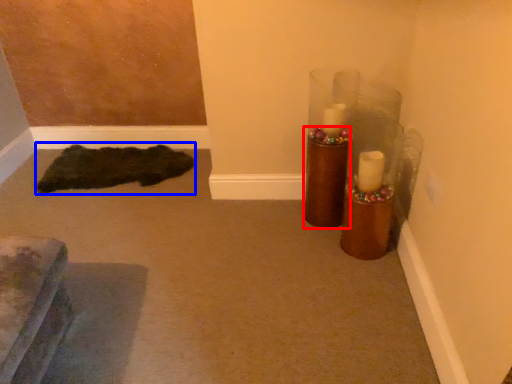
Question: Which object is further to the camera taking this photo, candle holder (highlighted by a red box) or doormat (highlighted by a blue box)?

Choices:
 (A) candle holder
 (B) doormat

Answer: (B)